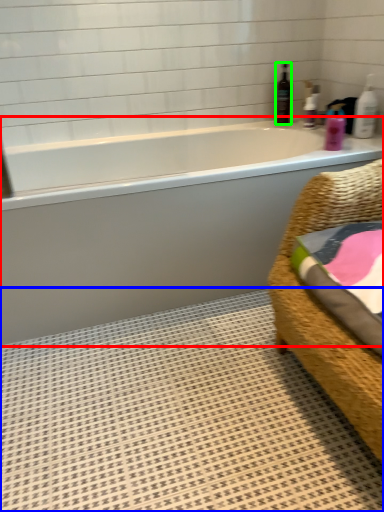
Question: Which is nearer to the bathtub (highlighted by a red box)? bath mat (highlighted by a blue box) or bottle (highlighted by a green box).

Choices:
 (A) bath mat
 (B) bottle

Answer: (A)